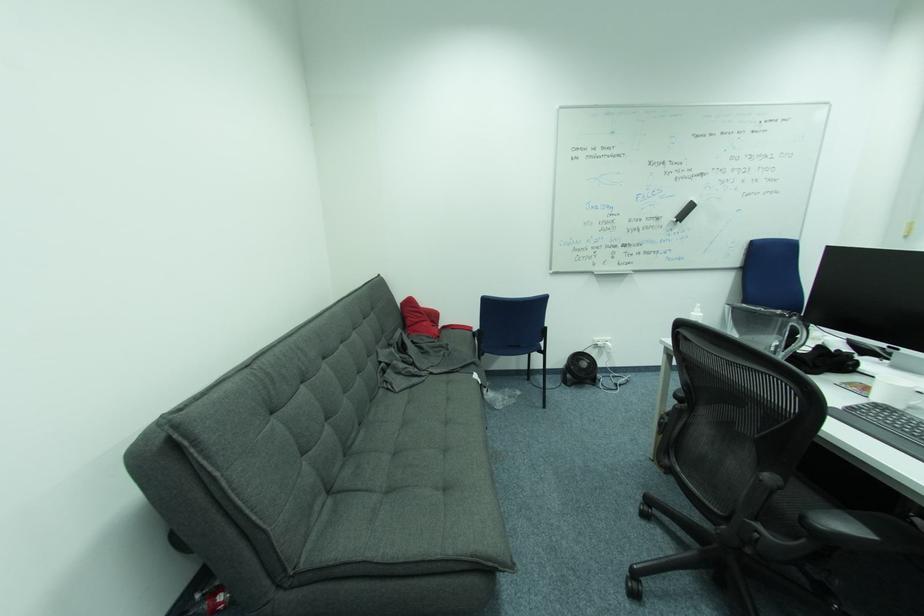
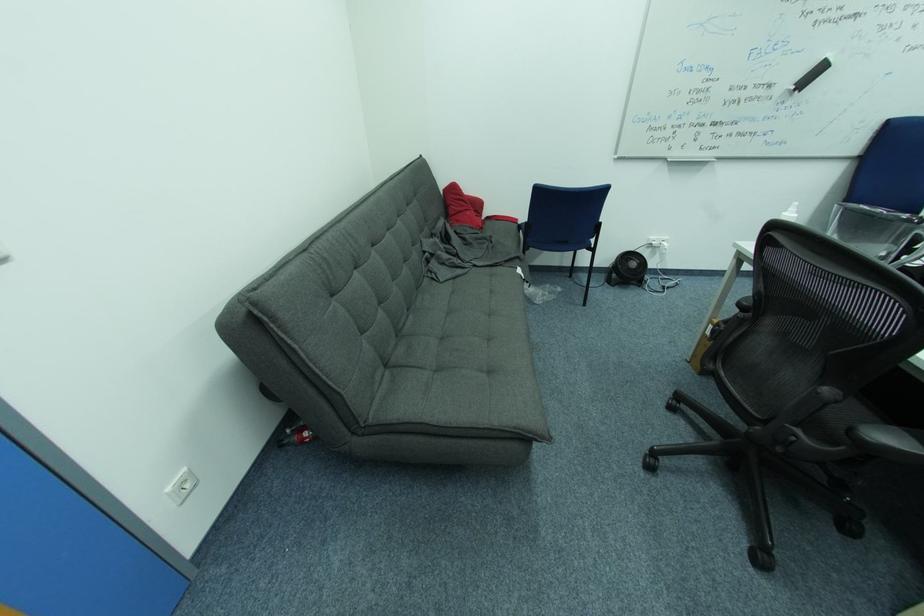
The point at (809, 517) is marked in the first image. Where is the corresponding point in the second image?

(858, 430)